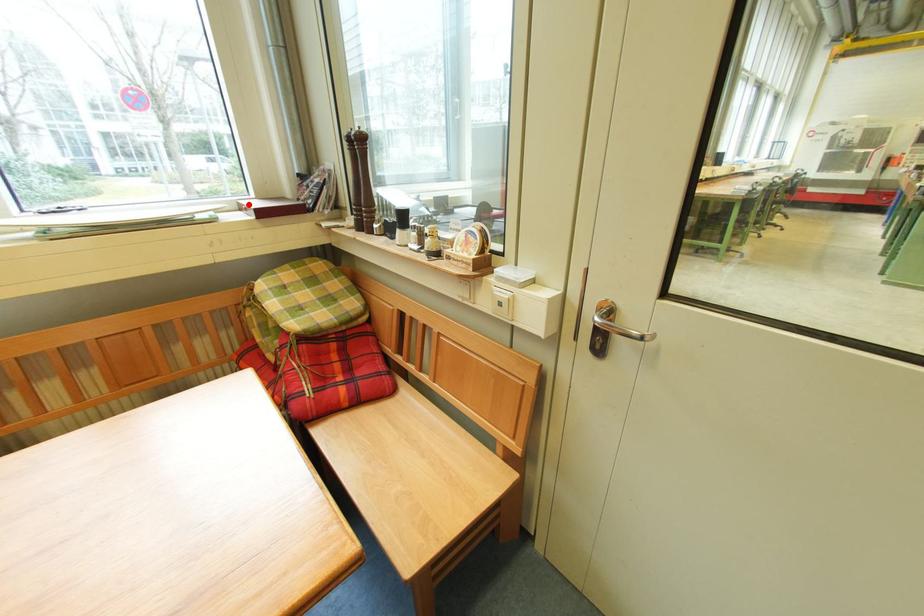
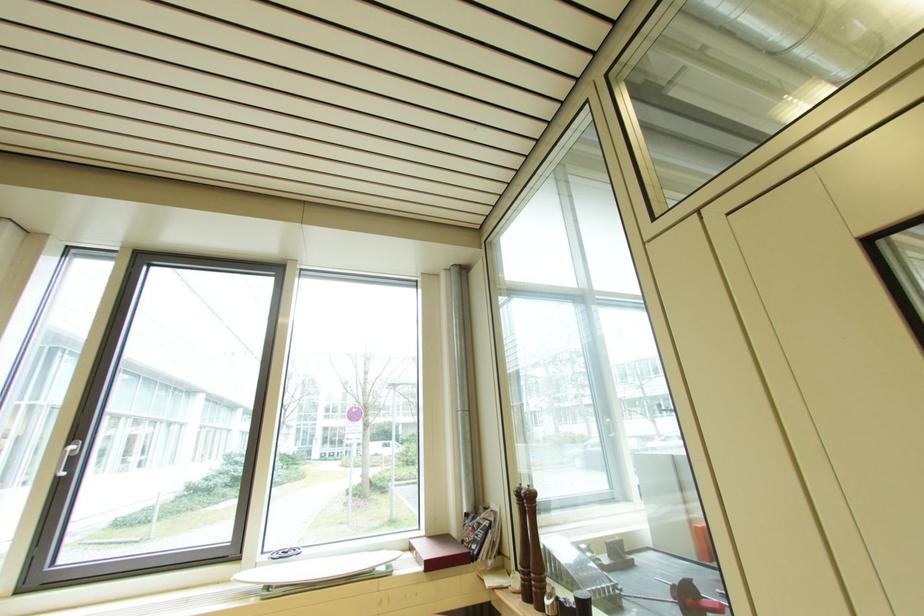
Where in the second image is the point corresponding to the highlighted location from the first image?

(420, 545)